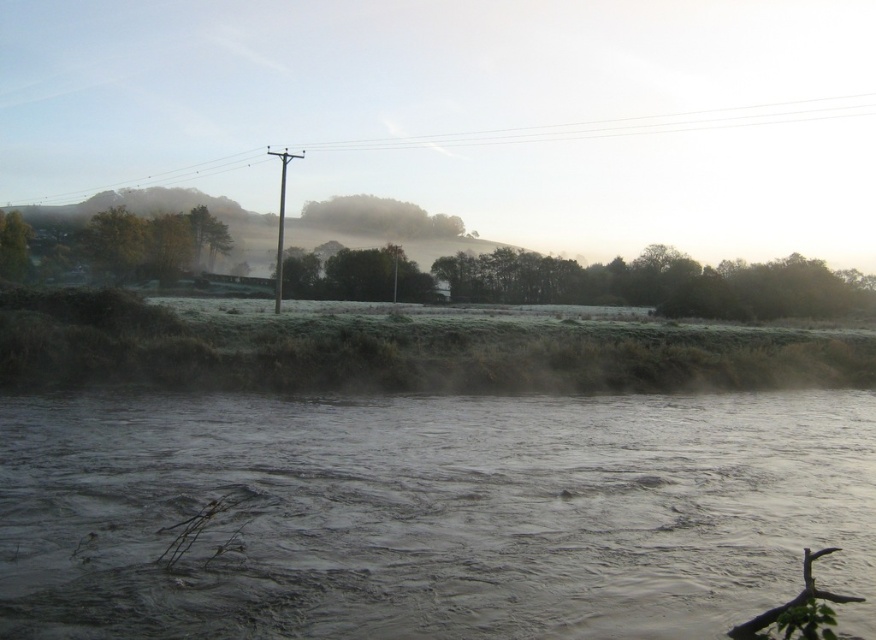
You are standing at the point marked by the coordinates point (622, 125), which is the smooth wood pole at upper center. Looking towards the direction of the smooth wood pole at upper center, what is the first object you would encounter if you walk straight ahead?

The first object you would encounter walking straight ahead from point (622, 125) is the smooth wood pole at upper center itself, as you are already at its location.

You are standing at the origin point in the rural landscape. Which direction should you move to reach the green matte tree at center?

The green matte tree at center is located at point 0.341 on the x and 0.434 on the y coordinate, so you should move northeast to reach it.